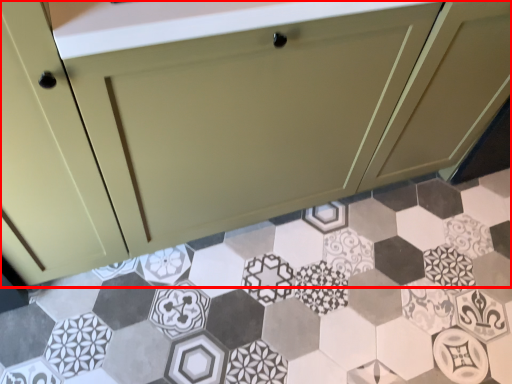
Question: Where is cabinetry (annotated by the red box) located in relation to porcelain in the image?

Choices:
 (A) right
 (B) left

Answer: (B)